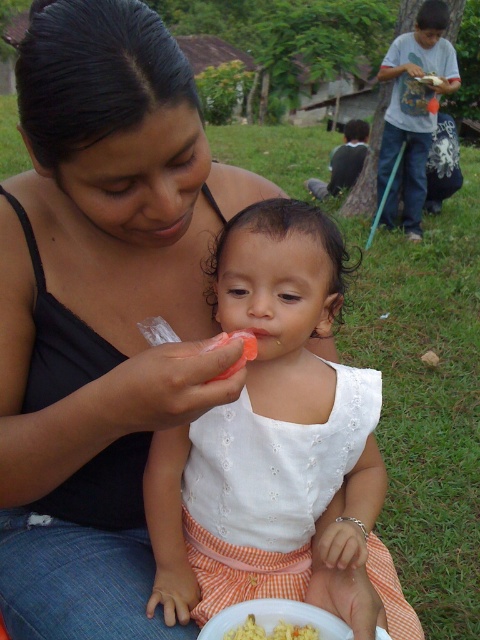
Does yellow matte scrambled eggs at lower center come behind orange translucent food at center?

That is True.

Can you confirm if yellow matte scrambled eggs at lower center is positioned to the right of orange translucent food at center?

Correct, you'll find yellow matte scrambled eggs at lower center to the right of orange translucent food at center.

Where is `yellow matte scrambled eggs at lower center`? yellow matte scrambled eggs at lower center is located at coordinates click(271, 632).

This screenshot has height=640, width=480. In order to click on yellow matte scrambled eggs at lower center in this screenshot , I will do `click(271, 632)`.

Can you confirm if white cotton shirt at center is positioned above white cotton shirt at upper right?

Actually, white cotton shirt at center is below white cotton shirt at upper right.

Is white cotton shirt at center positioned before white cotton shirt at upper right?

Yes, white cotton shirt at center is closer to the viewer.

Which is in front, point (257, 452) or point (403, 221)?

Point (257, 452) is in front.

Where is `white cotton shirt at center`? white cotton shirt at center is located at coordinates (274, 438).

Which is behind, point (435, 28) or point (238, 333)?

Point (435, 28)

Is white cotton shirt at upper right thinner than orange translucent food at center?

No.

Is point (410, 92) less distant than point (219, 339)?

No, it is not.

Where is `white cotton shirt at upper right`? white cotton shirt at upper right is located at coordinates (412, 112).